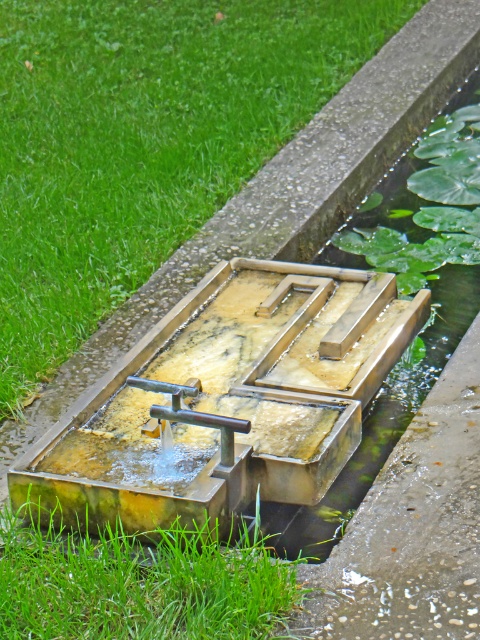
Question: Is green grass at upper left to the left of green grass at lower left from the viewer's perspective?

Choices:
 (A) no
 (B) yes

Answer: (B)

Question: Is green grass at upper left to the right of green grass at lower left from the viewer's perspective?

Choices:
 (A) no
 (B) yes

Answer: (A)

Question: Which of the following is the farthest from the observer?

Choices:
 (A) (105, 52)
 (B) (166, 388)
 (C) (254, 573)

Answer: (A)

Question: Estimate the real-world distances between objects in this image. Which object is farther from the green grass at upper left?

Choices:
 (A) green grass at lower left
 (B) polished brass faucet at center

Answer: (B)

Question: Which point is farther to the camera?

Choices:
 (A) (162, 595)
 (B) (175, 396)
 (C) (367, 12)

Answer: (C)

Question: Can you confirm if green grass at upper left is positioned to the right of green grass at lower left?

Choices:
 (A) no
 (B) yes

Answer: (A)